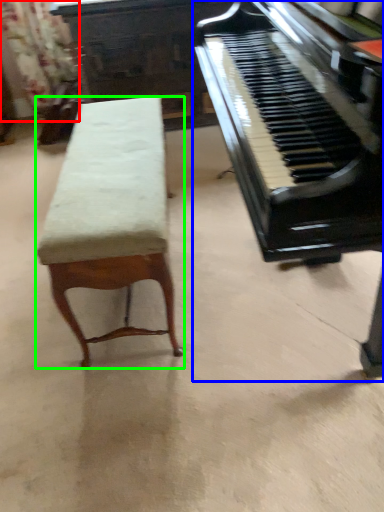
Question: Considering the real-world distances, which object is farthest from curtain (highlighted by a red box)? piano (highlighted by a blue box) or furniture (highlighted by a green box)?

Choices:
 (A) piano
 (B) furniture

Answer: (A)